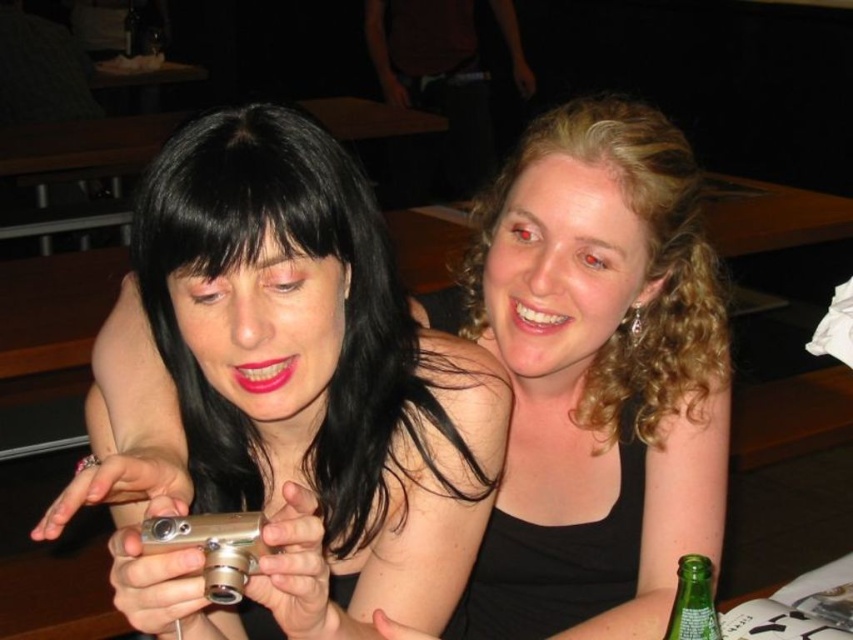
You are at a social event and want to take a photo of the matte silver camera at center and the green glass bottle at lower right. To ensure both are in frame, where should you position your phone camera?

Position your phone camera so that the matte silver camera at center is above the green glass bottle at lower right, as the matte silver camera at center is positioned over the green glass bottle at lower right in the scene.

You are a bartender at this bar. You need to place a green glass bottle at lower right on the counter behind the matte silver camera at center. Can you fit it there if the space between them is 10 cm?

The matte silver camera at center is larger than the green glass bottle at lower right, but the exact dimensions are not provided. However, since the space between them is 10 cm, it might be possible to fit the green glass bottle at lower right there if its width is less than 10 cm. Without specific measurements, it is uncertain.